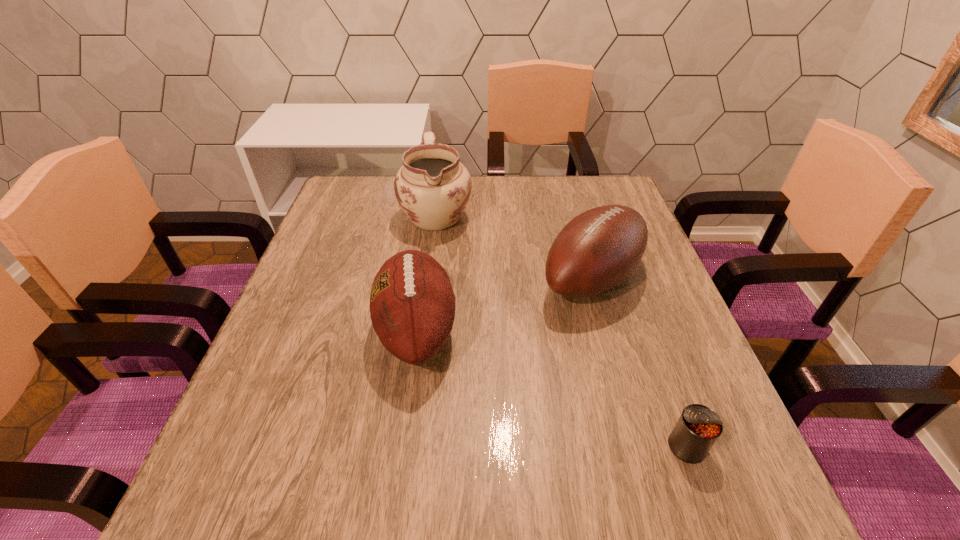
Identify the location of vacant space that satisfies the following two spatial constraints: 1. on the spout of the right football (American); 2. on the right side of the farthest object. (427, 279).